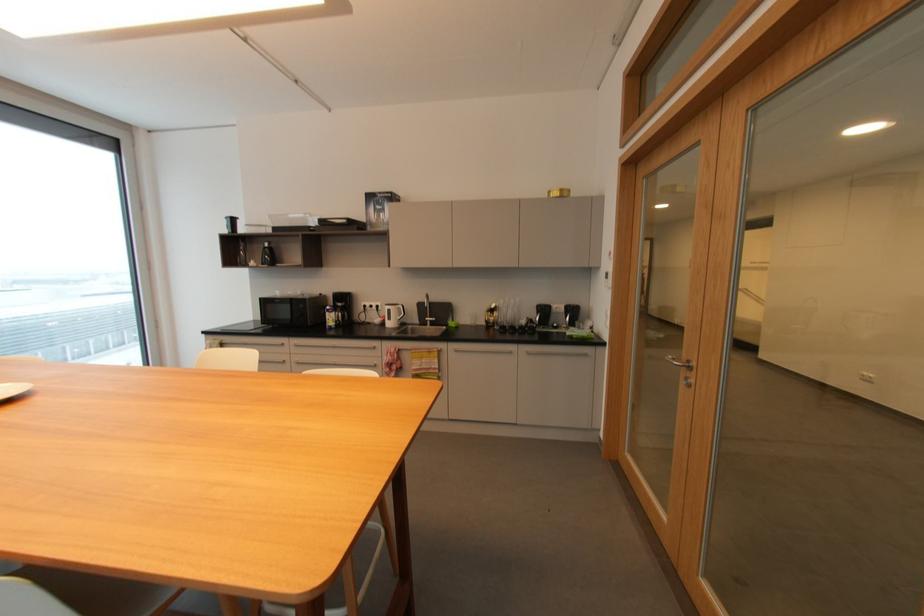
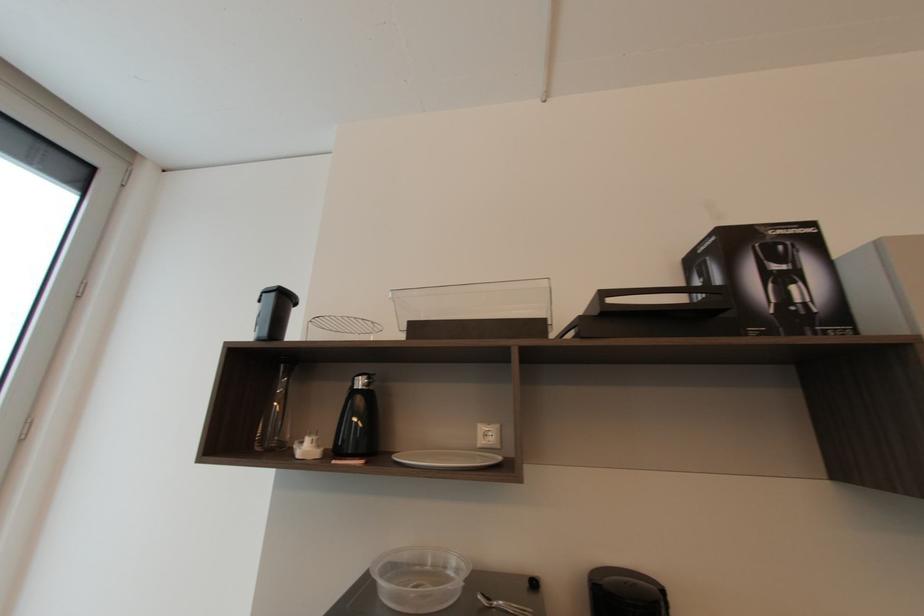
What movement of the cameraman would produce the second image?

The cameraman walked toward left, forward.